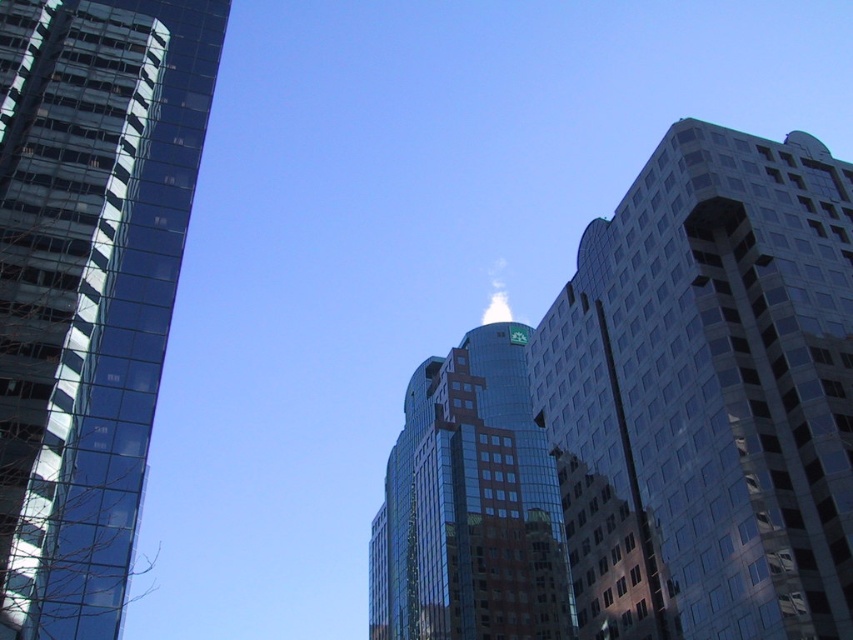
In the scene shown: You are an architect analyzing the buildings in the image. Which of the two buildings, the glassy blue skyscraper at right or the glassy reflective building at center, has a narrower width?

The glassy blue skyscraper at right is thinner than the glassy reflective building at center, so it has a narrower width.

You are standing in the middle of the city square and see the point marked at coordinates (718, 380). What does this point indicate?

The point at coordinates (718, 380) marks the glassy blue skyscraper at right.